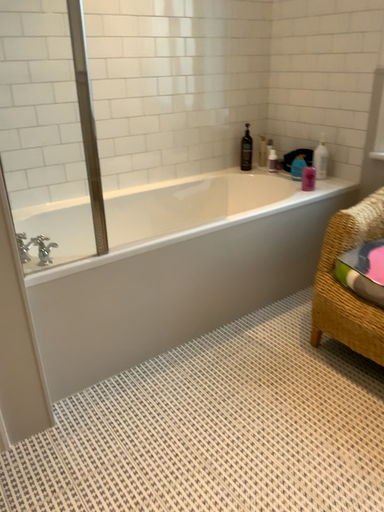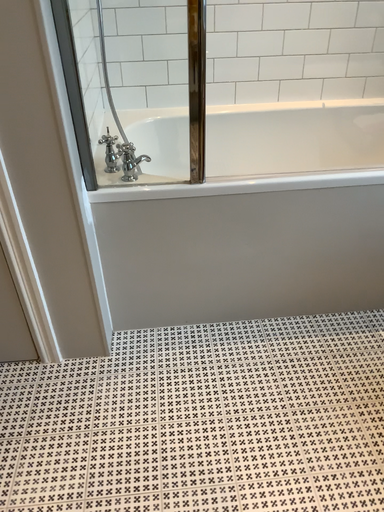
Question: How did the camera likely rotate when shooting the video?

Choices:
 (A) rotated downward
 (B) rotated upward

Answer: (A)